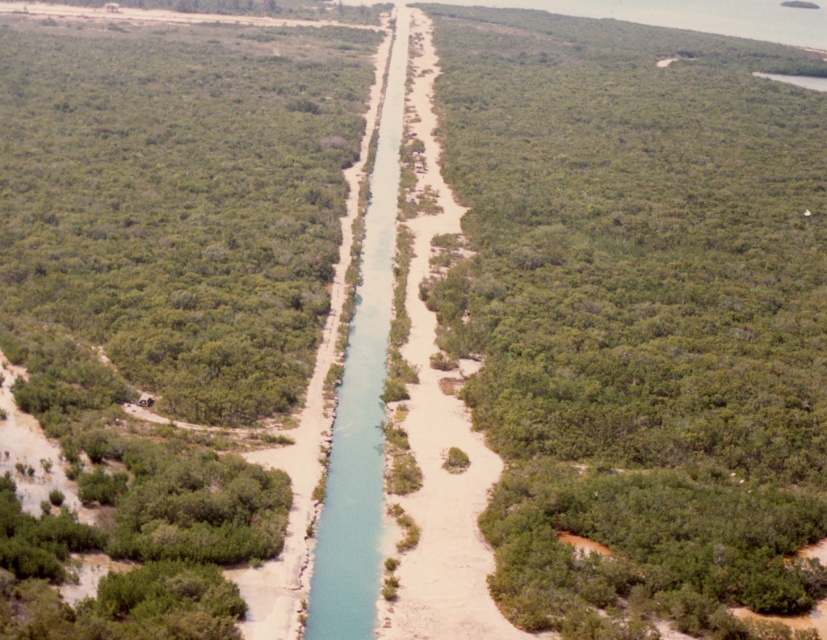
You are a drone operator trying to navigate a small drone through the narrow waterway shown in the image. The drone has a wingspan of 1 meter. Based on the scene, can the drone safely pass through the waterway between the green leafy shrubs at center and the blue smooth waterway at center?

The green leafy shrubs at center might be wider than the blue smooth waterway at center, so there is uncertainty about whether the drone with a 1 meter wingspan can safely pass. Further measurement or clearance confirmation is needed.

You are a drone operator tasked with mapping the waterway. You notice the green leafy vegetation at center in the aerial image. Based on its coordinates, can you determine if it is positioned closer to the left or right bank of the canal?

Result: The green leafy vegetation at center is located at point 0.494 on the x and 0.773 on the y. Since the coordinates are close to 0.5 on the x, it is positioned near the center of the waterway, equidistant from both banks.